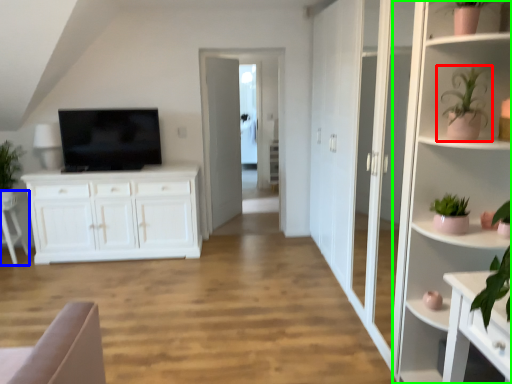
Question: Estimate the real-world distances between objects in this image. Which object is farther from houseplant (highlighted by a red box), armchair (highlighted by a blue box) or shelf (highlighted by a green box)?

Choices:
 (A) armchair
 (B) shelf

Answer: (A)